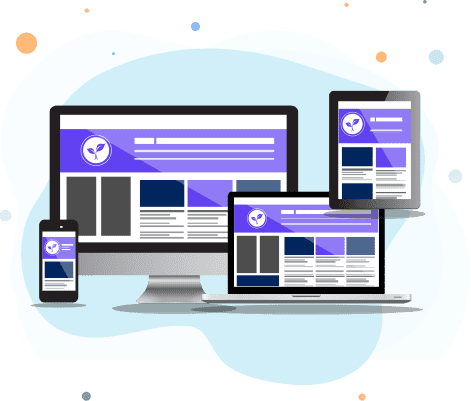
The height and width of the screenshot is (401, 471). I want to click on mockup of a computer monitor, so click(x=177, y=156).